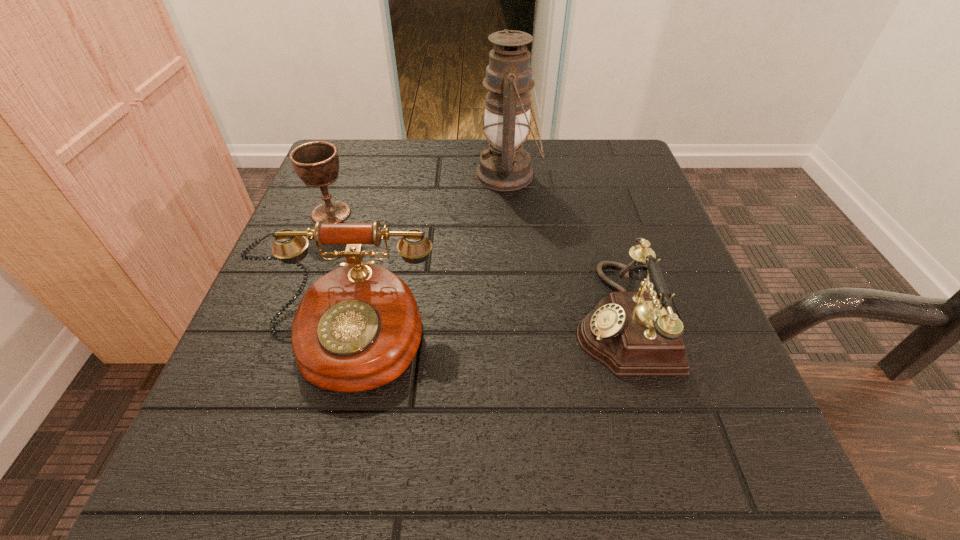
In order to click on vacant space at the right edge of the desktop in this screenshot , I will do `click(716, 361)`.

Identify the location of free space at the far left corner of the desktop. (396, 145).

I want to click on free space at the far right corner of the desktop, so click(603, 148).

Image resolution: width=960 pixels, height=540 pixels. What are the coordinates of `unoccupied position between the taller telephone and the shorter telephone` in the screenshot? It's located at (483, 328).

Locate an element on the screen. Image resolution: width=960 pixels, height=540 pixels. vacant space that is in between the shorter telephone and the chalice is located at coordinates (476, 265).

Where is `vacant point located between the third object from left to right and the chalice`? The image size is (960, 540). vacant point located between the third object from left to right and the chalice is located at coordinates (420, 194).

The height and width of the screenshot is (540, 960). Identify the location of empty space that is in between the chalice and the third object from left to right. [420, 194].

Where is `empty space that is in between the shorter telephone and the chalice`? The image size is (960, 540). empty space that is in between the shorter telephone and the chalice is located at coordinates (476, 265).

At what (x,y) coordinates should I click in order to perform the action: click on vacant space that is in between the right telephone and the chalice. Please return your answer as a coordinate pair (x, y). Looking at the image, I should click on (476, 265).

Identify which object is located as the third nearest to the chalice. Please provide its 2D coordinates. Your answer should be formatted as a tuple, i.e. [(x, y)], where the tuple contains the x and y coordinates of a point satisfying the conditions above.

[(631, 333)]